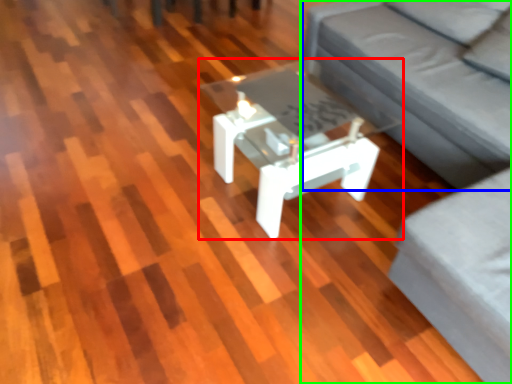
Question: Based on their relative distances, which object is farther from coffee table (highlighted by a red box)? Choose from couch (highlighted by a blue box) and studio couch (highlighted by a green box).

Choices:
 (A) couch
 (B) studio couch

Answer: (B)